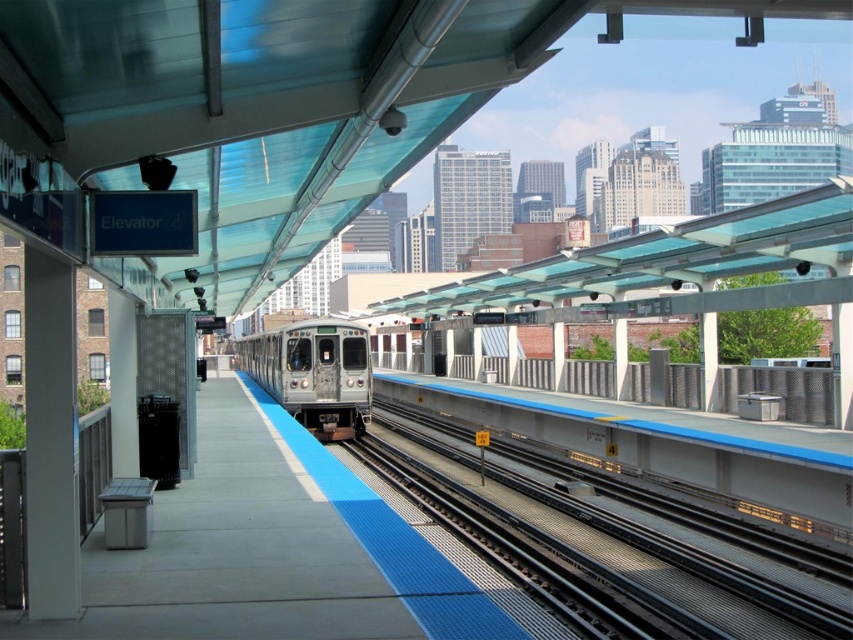
Question: Does metallic gray tracks at center appear on the right side of silver metallic train at center?

Choices:
 (A) yes
 (B) no

Answer: (A)

Question: Which point appears farthest from the camera in this image?

Choices:
 (A) (554, 504)
 (B) (329, 348)

Answer: (B)

Question: Does metallic gray tracks at center appear on the left side of silver metallic train at center?

Choices:
 (A) yes
 (B) no

Answer: (B)

Question: Considering the relative positions of metallic gray tracks at center and silver metallic train at center in the image provided, where is metallic gray tracks at center located with respect to silver metallic train at center?

Choices:
 (A) above
 (B) below

Answer: (B)